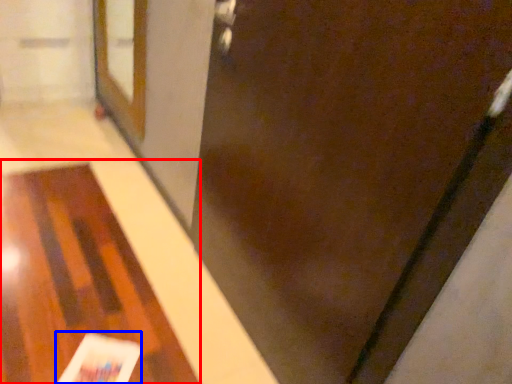
Question: Which object appears closest to the camera in this image, table (highlighted by a red box) or magazine (highlighted by a blue box)?

Choices:
 (A) table
 (B) magazine

Answer: (A)